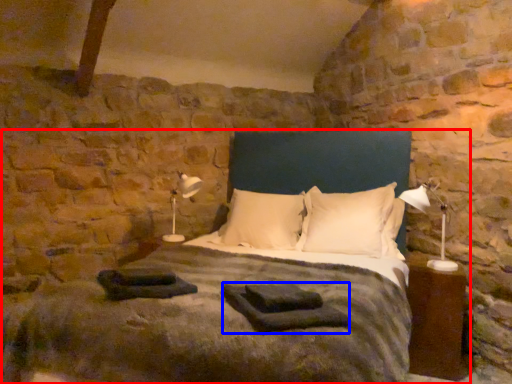
Question: Which of the following is the farthest to the observer, bed (highlighted by a red box) or material (highlighted by a blue box)?

Choices:
 (A) bed
 (B) material

Answer: (B)